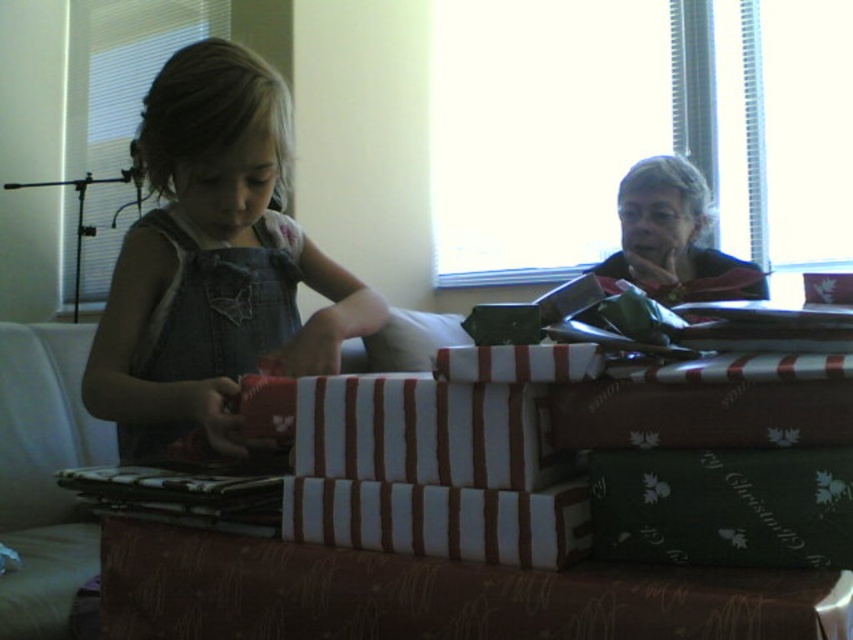
You are a tailor measuring the distance between two denim items in the image. The denim overalls at center and the matte denim dress at left are part of your project. Can you fit both items on a 2.5 inch wide tailor board without overlapping?

The denim overalls at center and the matte denim dress at left are 2.21 inches apart from each other. Since 2.21 inches is less than 2.5 inches, both items can fit on the tailor board without overlapping.

You are a fashion designer observing the scene. You need to determine which clothing item, the denim overalls at center or the matte denim dress at left, would be more suitable for a child who needs to sit on the floor while playing. Consider their height differences as seen in the image.

The denim overalls at center is taller than the matte denim dress at left, so the matte denim dress at left would be more suitable for a child sitting on the floor as it allows for easier movement without excess fabric.

You are standing in the room and see two points in the scene. The first point is at coordinate point (207,214) and the second is at point (157,451). Which point is closer to you?

Point (207,214) is in front of point (157,451), so it is closer to you.